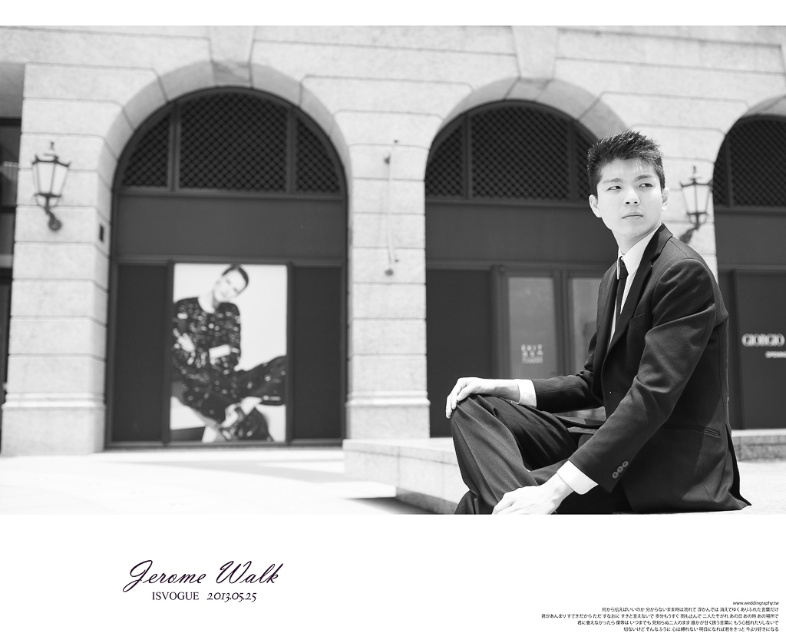
Does smooth black suit at right appear under matte black tie at center?

Indeed, smooth black suit at right is positioned under matte black tie at center.

Who is shorter, smooth black suit at right or matte black tie at center?

With less height is matte black tie at center.

Between point (671, 333) and point (619, 288), which one is positioned in front?

Positioned in front is point (671, 333).

Identify the location of smooth black suit at right. (614, 380).